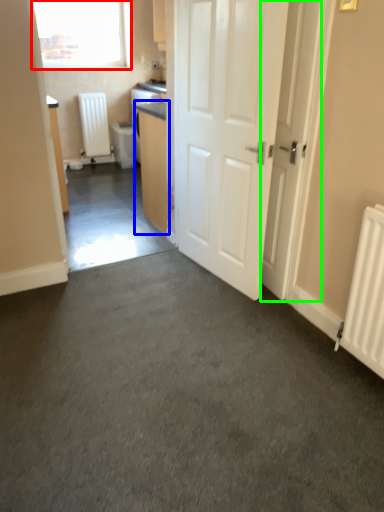
Question: Which object is positioned farthest from window (highlighted by a red box)? Select from cabinetry (highlighted by a blue box) and door (highlighted by a green box).

Choices:
 (A) cabinetry
 (B) door

Answer: (B)